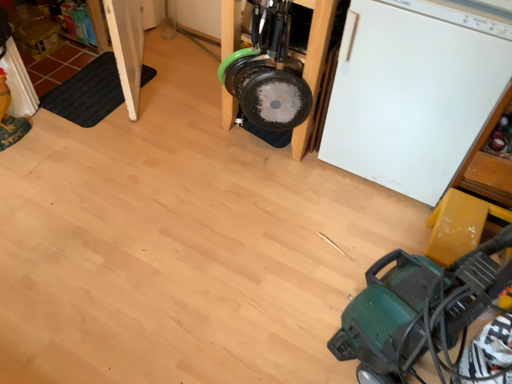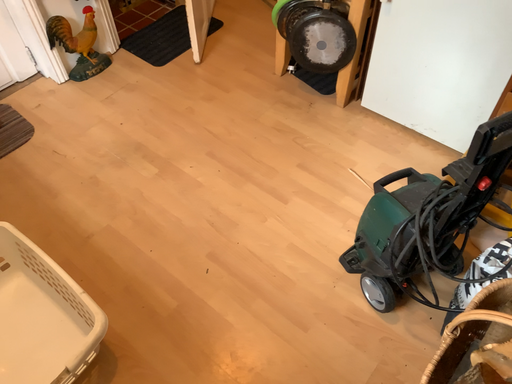
Question: How did the camera likely rotate when shooting the video?

Choices:
 (A) rotated left
 (B) rotated right

Answer: (A)